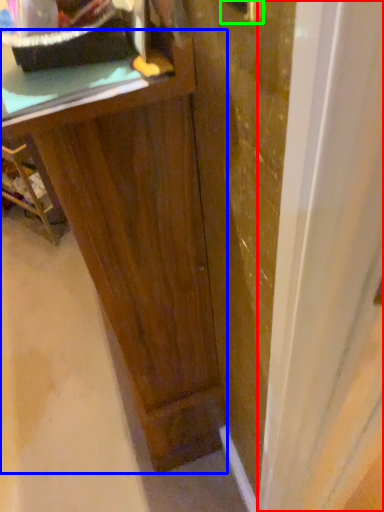
Question: Which is nearer to the glass door (highlighted by a red box)? vanity (highlighted by a blue box) or door handle (highlighted by a green box).

Choices:
 (A) vanity
 (B) door handle

Answer: (A)